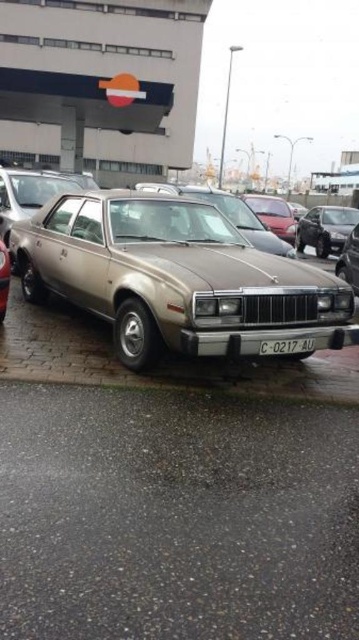
You are standing at the entrance of the gas station and want to park your car in the parking spot where the vintage car is currently parked. The parking spot has a coordinate system where the bottom left corner is the origin. The vintage car is occupying a spot with its center at point (x=174, y=444). If your car is 4.5 meters long and 1.8 meters wide, will it fit in the parking spot without overlapping the vintage car?

The point (x=174, y=444) corresponds to the metallic gold car at center. Since the vintage car is already occupying the center of the parking spot, your car would overlap with it unless you can park precisely on top of the existing car, which is not possible. Therefore, your car will not fit in the parking spot without overlapping the vintage car.

You are standing in a parking lot and see the metallic gold car at center. If you want to walk to the car, how many steps would you need to take if each step is about 2.5 feet long?

The metallic gold car at center is 4.87 feet away. Since each step is about 2.5 feet long, you would need to take approximately 2 steps to reach the car.

You are a photographer planning to take a photo of the metallic gold car at center and the gold metallic sedan at center in the parking lot. Since you want to emphasize the size difference between them, which car should you position closer to the camera to make it appear bigger?

To emphasize the size difference between the metallic gold car at center and the gold metallic sedan at center, you should position the smaller gold metallic sedan at center closer to the camera. Since the metallic gold car at center is larger in size, placing the smaller one nearer will create a visual contrast where both appear similarly sized, thereby highlighting their actual size difference when viewed from a distance.